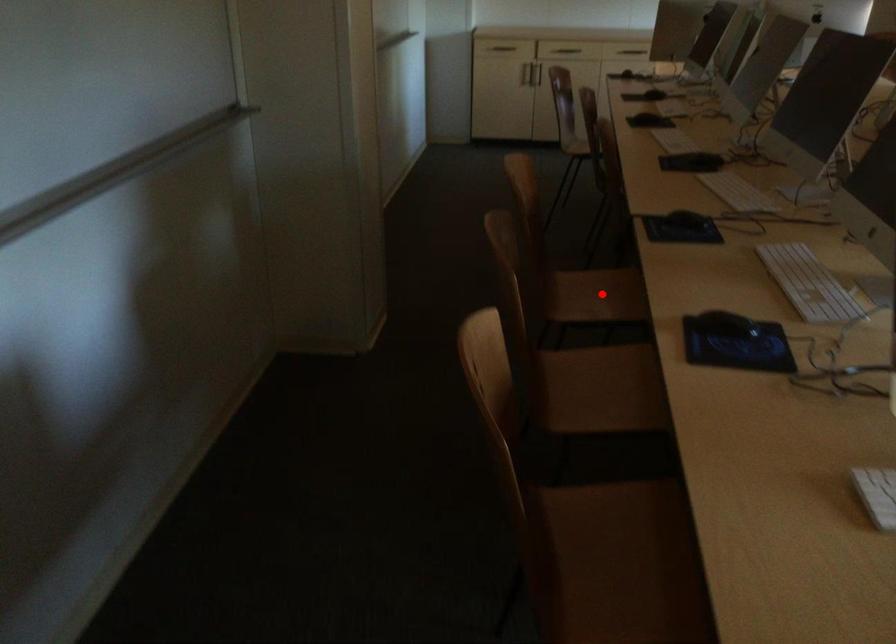
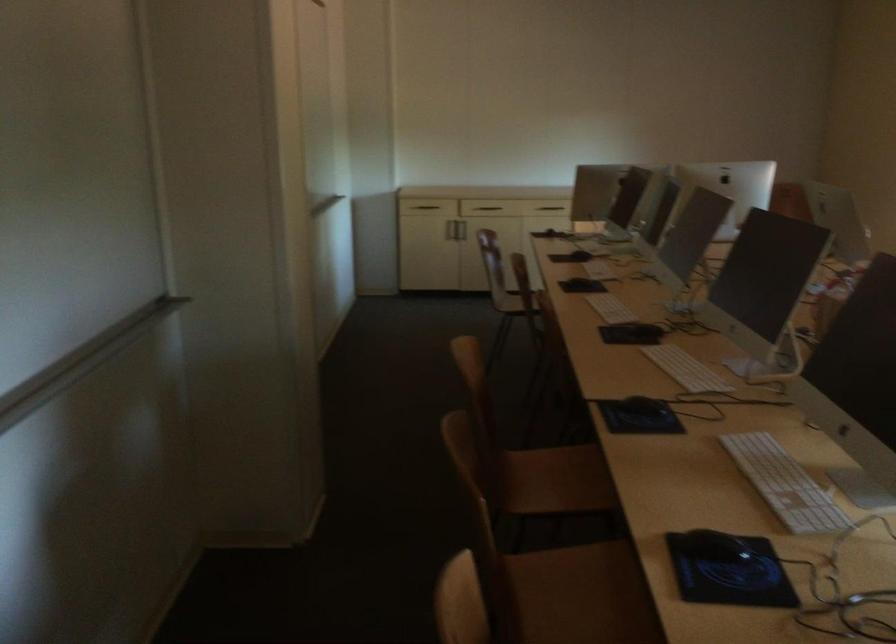
The point at the highlighted location is marked in the first image. Where is the corresponding point in the second image?

(556, 480)